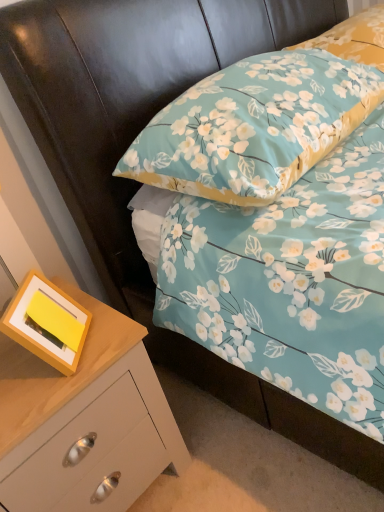
Question: Is yellow matte picture frame at lower left further to the viewer compared to floral fabric pillow at upper center, acting as the first pillow starting from the bottom?

Choices:
 (A) no
 (B) yes

Answer: (B)

Question: Is yellow matte picture frame at lower left far away from floral fabric pillow at upper center, marked as the second pillow in a top-to-bottom arrangement?

Choices:
 (A) yes
 (B) no

Answer: (B)

Question: Considering the relative sizes of yellow matte picture frame at lower left and floral fabric pillow at upper center, marked as the second pillow in a top-to-bottom arrangement, in the image provided, is yellow matte picture frame at lower left wider than floral fabric pillow at upper center, marked as the second pillow in a top-to-bottom arrangement,?

Choices:
 (A) yes
 (B) no

Answer: (B)

Question: Does yellow matte picture frame at lower left have a larger size compared to floral fabric pillow at upper center, marked as the second pillow in a top-to-bottom arrangement?

Choices:
 (A) yes
 (B) no

Answer: (B)

Question: Is yellow matte picture frame at lower left smaller than floral fabric pillow at upper center, marked as the second pillow in a top-to-bottom arrangement?

Choices:
 (A) no
 (B) yes

Answer: (B)

Question: Is yellow matte picture frame at lower left to the right of floral fabric pillow at upper center, marked as the second pillow in a top-to-bottom arrangement, from the viewer's perspective?

Choices:
 (A) no
 (B) yes

Answer: (A)

Question: Considering the relative sizes of yellow matte picture frame at lower left and floral fabric pillow at upper right, the second pillow positioned from the bottom, in the image provided, is yellow matte picture frame at lower left bigger than floral fabric pillow at upper right, the second pillow positioned from the bottom,?

Choices:
 (A) yes
 (B) no

Answer: (B)

Question: Is yellow matte picture frame at lower left at the left side of floral fabric pillow at upper right, the first pillow positioned from the top?

Choices:
 (A) no
 (B) yes

Answer: (B)

Question: Does yellow matte picture frame at lower left have a greater width compared to floral fabric pillow at upper right, the first pillow positioned from the top?

Choices:
 (A) yes
 (B) no

Answer: (B)

Question: Considering the relative positions of yellow matte picture frame at lower left and floral fabric pillow at upper right, the first pillow positioned from the top, in the image provided, is yellow matte picture frame at lower left in front of floral fabric pillow at upper right, the first pillow positioned from the top,?

Choices:
 (A) yes
 (B) no

Answer: (A)

Question: Is yellow matte picture frame at lower left positioned far away from floral fabric pillow at upper right, the second pillow positioned from the bottom?

Choices:
 (A) yes
 (B) no

Answer: (A)

Question: Considering the relative sizes of yellow matte picture frame at lower left and floral fabric pillow at upper right, the first pillow positioned from the top, in the image provided, is yellow matte picture frame at lower left smaller than floral fabric pillow at upper right, the first pillow positioned from the top,?

Choices:
 (A) yes
 (B) no

Answer: (A)

Question: Does floral fabric pillow at upper right, the first pillow positioned from the top, have a larger size compared to floral fabric pillow at upper center, acting as the first pillow starting from the bottom?

Choices:
 (A) no
 (B) yes

Answer: (A)